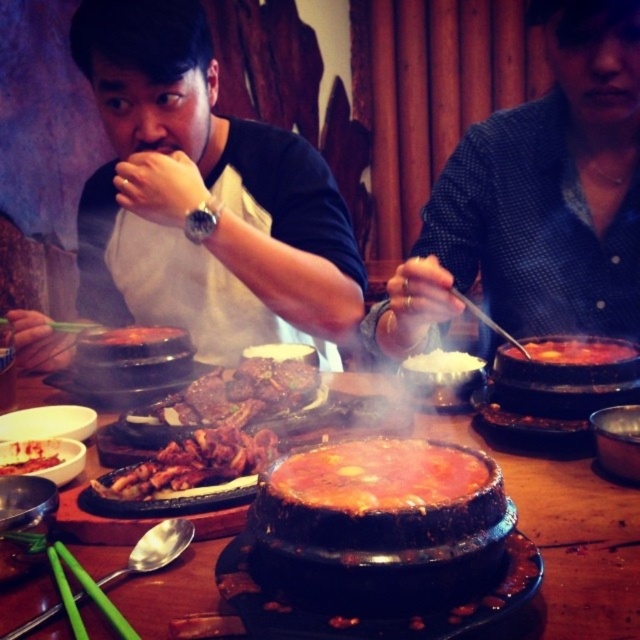
Can you confirm if blue checkered shirt at upper right is positioned to the left of grilled meat at center?

In fact, blue checkered shirt at upper right is to the right of grilled meat at center.

Does point (593, 3) lie behind point (273, 397)?

No.

Locate an element on the screen. The image size is (640, 640). blue checkered shirt at upper right is located at coordinates (538, 198).

Can you confirm if black stone pot at center is taller than smokey red sauce at center?

Yes.

Is black stone pot at center thinner than smokey red sauce at center?

Incorrect, black stone pot at center's width is not less than smokey red sauce at center's.

This screenshot has width=640, height=640. Describe the element at coordinates (566, 538) in the screenshot. I see `black stone pot at center` at that location.

This screenshot has height=640, width=640. Identify the location of black stone pot at center. (566, 538).

Measure the distance between blue checkered shirt at upper right and brown glossy meat at center.

The distance of blue checkered shirt at upper right from brown glossy meat at center is 51.39 centimeters.

Is blue checkered shirt at upper right above brown glossy meat at center?

Yes.

Is point (413, 284) in front of point (106, 493)?

No, it is not.

Locate an element on the screen. The width and height of the screenshot is (640, 640). blue checkered shirt at upper right is located at coordinates (538, 198).